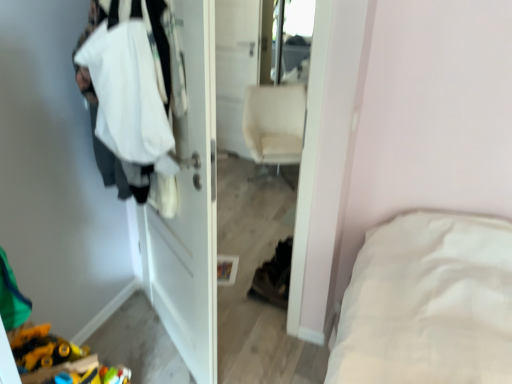
At what (x,y) coordinates should I click in order to perform the action: click on white fabric at left. Please return your answer as a coordinate pair (x, y). The image size is (512, 384). Looking at the image, I should click on (149, 43).

The height and width of the screenshot is (384, 512). What do you see at coordinates (296, 38) in the screenshot?
I see `glossy plastic mirror at upper center` at bounding box center [296, 38].

The height and width of the screenshot is (384, 512). I want to click on glossy plastic mirror at upper center, so click(296, 38).

Describe the element at coordinates (189, 208) in the screenshot. I see `white matte door at center` at that location.

Locate an element on the screen. white fabric at left is located at coordinates (149, 43).

How far apart are glossy plastic mirror at upper center and white fabric at left?

glossy plastic mirror at upper center and white fabric at left are 9.82 feet apart from each other.

What's the angular difference between glossy plastic mirror at upper center and white fabric at left's facing directions?

The angle between the facing direction of glossy plastic mirror at upper center and the facing direction of white fabric at left is 34.8 degrees.

Looking at their sizes, would you say glossy plastic mirror at upper center is wider or thinner than white fabric at left?

glossy plastic mirror at upper center is thinner than white fabric at left.

Is the depth of glossy plastic mirror at upper center less than that of white fabric at left?

No, it is not.

Does white matte door at center turn towards white fabric at left?

Yes, white matte door at center is turned towards white fabric at left.

Which of these two, white matte door at center or white fabric at left, is smaller?

With smaller size is white matte door at center.

From a real-world perspective, which object rests below the other?

white matte door at center is physically lower.

Is white matte door at center positioned with its back to beige fabric chair at center?

That's not correct — white matte door at center is not looking away from beige fabric chair at center.

Is white matte door at center completely or partially outside of beige fabric chair at center?

Yes, white matte door at center is located beyond the bounds of beige fabric chair at center.

From a real-world perspective, is white matte door at center above or below beige fabric chair at center?

white matte door at center is situated higher than beige fabric chair at center in the real world.

Does white matte door at center appear on the left side of beige fabric chair at center?

Yes, white matte door at center is to the left of beige fabric chair at center.

From a real-world perspective, is beige fabric chair at center above or below glossy plastic mirror at upper center?

beige fabric chair at center is below glossy plastic mirror at upper center.

Which point is more distant from viewer, [284,109] or [311,31]?

The point [311,31] is behind.

Which is behind, beige fabric chair at center or glossy plastic mirror at upper center?

glossy plastic mirror at upper center is more distant.

From the image's perspective, which object appears higher, white fabric at left or glossy plastic mirror at upper center?

glossy plastic mirror at upper center.

Is white fabric at left inside the boundaries of glossy plastic mirror at upper center, or outside?

white fabric at left is spatially situated outside glossy plastic mirror at upper center.

Considering the sizes of white fabric at left and glossy plastic mirror at upper center in the image, is white fabric at left taller or shorter than glossy plastic mirror at upper center?

Considering their sizes, white fabric at left has less height than glossy plastic mirror at upper center.

Is glossy plastic mirror at upper center in front of white matte door at center?

No, the depth of glossy plastic mirror at upper center is greater than that of white matte door at center.

From the image's perspective, does glossy plastic mirror at upper center appear lower than white matte door at center?

No, from the image's perspective, glossy plastic mirror at upper center is not beneath white matte door at center.

Considering the sizes of objects glossy plastic mirror at upper center and white matte door at center in the image provided, who is wider, glossy plastic mirror at upper center or white matte door at center?

Wider between the two is glossy plastic mirror at upper center.

This screenshot has width=512, height=384. I want to click on door lying in front of the beige fabric chair at center, so click(189, 208).

Is beige fabric chair at center shorter than white matte door at center?

Yes, beige fabric chair at center is shorter than white matte door at center.

Considering the sizes of objects beige fabric chair at center and white matte door at center in the image provided, who is smaller, beige fabric chair at center or white matte door at center?

white matte door at center.

Is beige fabric chair at center aimed at white matte door at center?

Yes, beige fabric chair at center is turned towards white matte door at center.

The image size is (512, 384). Find the location of `mirror that is under the white fabric at left (from a real-world perspective)`. mirror that is under the white fabric at left (from a real-world perspective) is located at coordinates (296, 38).

The width and height of the screenshot is (512, 384). Identify the location of clothing on the left side of white matte door at center. (149, 43).

Looking at the image, which one is located closer to beige fabric chair at center, white fabric at left or white matte door at center?

white matte door at center is positioned closer to the anchor beige fabric chair at center.

From the image, which object appears to be farther from glossy plastic mirror at upper center, beige fabric chair at center or white matte door at center?

white matte door at center.

Which object lies further to the anchor point glossy plastic mirror at upper center, white fabric at left or white matte door at center?

white fabric at left is positioned further to the anchor glossy plastic mirror at upper center.

Estimate the real-world distances between objects in this image. Which object is further from white fabric at left, beige fabric chair at center or glossy plastic mirror at upper center?

glossy plastic mirror at upper center is further to white fabric at left.

From the image, which object appears to be nearer to white matte door at center, beige fabric chair at center or glossy plastic mirror at upper center?

beige fabric chair at center is closer to white matte door at center.

Based on their spatial positions, is white matte door at center or glossy plastic mirror at upper center further from beige fabric chair at center?

The object further to beige fabric chair at center is white matte door at center.

Consider the image. When comparing their distances from white matte door at center, does white fabric at left or glossy plastic mirror at upper center seem closer?

Based on the image, white fabric at left appears to be nearer to white matte door at center.

Which object lies nearer to the anchor point beige fabric chair at center, white fabric at left or glossy plastic mirror at upper center?

glossy plastic mirror at upper center is closer to beige fabric chair at center.

Identify the location of door between white fabric at left and glossy plastic mirror at upper center in the front-back direction. This screenshot has width=512, height=384. (189, 208).

Locate an element on the screen. This screenshot has height=384, width=512. chair positioned between white fabric at left and glossy plastic mirror at upper center from near to far is located at coordinates (275, 124).

Where is `door located between white fabric at left and beige fabric chair at center in the depth direction`? door located between white fabric at left and beige fabric chair at center in the depth direction is located at coordinates (189, 208).

Image resolution: width=512 pixels, height=384 pixels. In order to click on chair between white matte door at center and glossy plastic mirror at upper center in the front-back direction in this screenshot , I will do `click(275, 124)`.